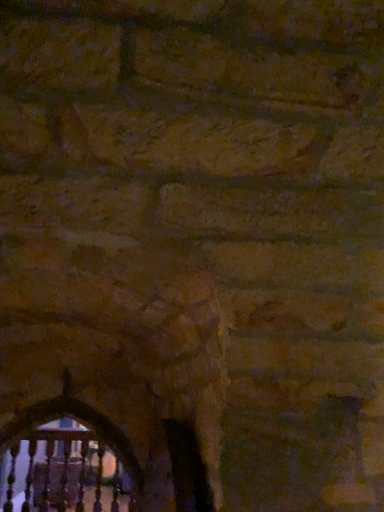
Describe the element at coordinates (81, 422) in the screenshot. I see `transparent glass window at lower left` at that location.

At what (x,y) coordinates should I click in order to perform the action: click on transparent glass window at lower left. Please return your answer as a coordinate pair (x, y). The image size is (384, 512). Looking at the image, I should click on (81, 422).

From the picture: Measure the distance between transparent glass window at lower left and camera.

transparent glass window at lower left and camera are 7.16 feet apart from each other.

Where is `transparent glass window at lower left`? This screenshot has width=384, height=512. transparent glass window at lower left is located at coordinates (81, 422).